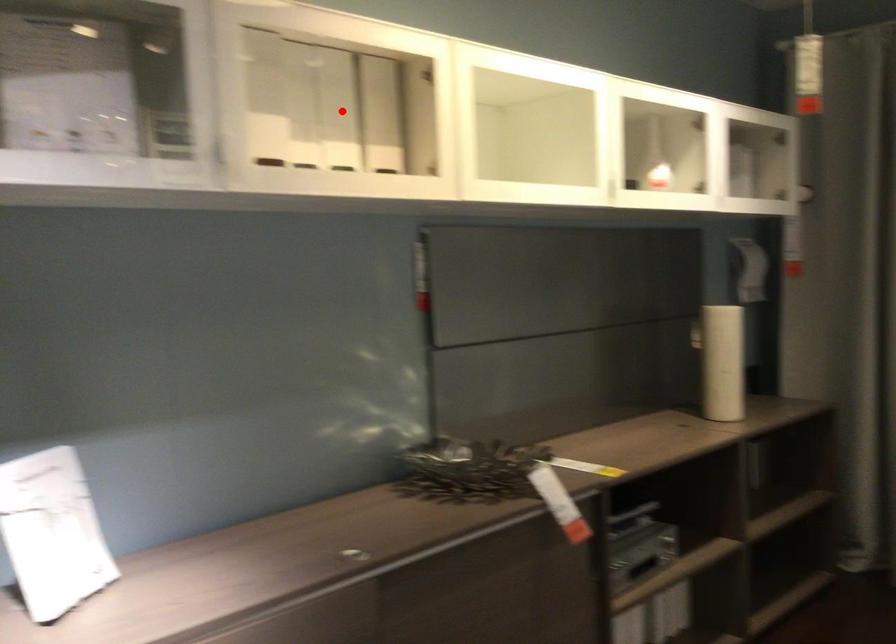
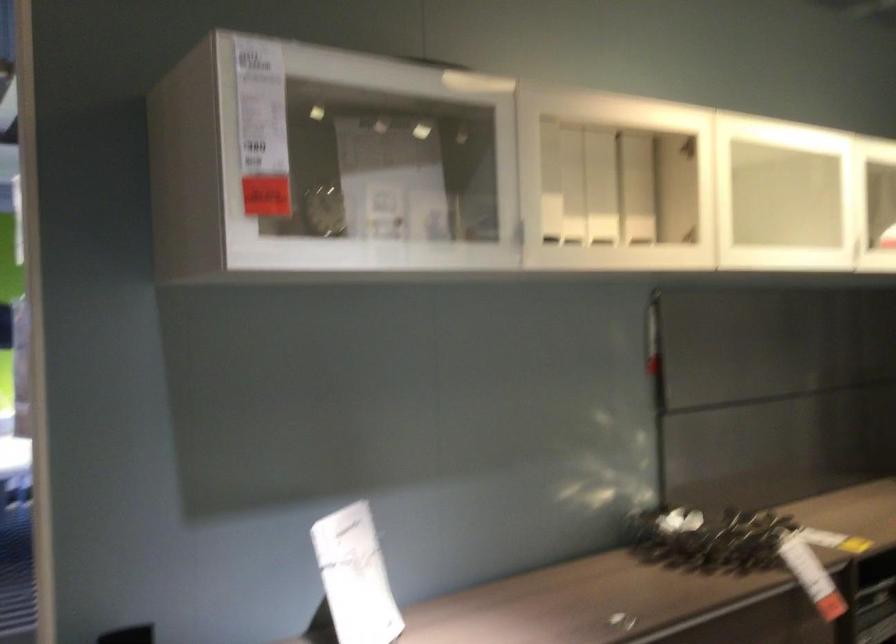
Question: I am providing you with two images of the same scene from different viewpoints. A red point is marked on the first image. Is the red point's position out of view in image 2?

Choices:
 (A) Yes
 (B) No

Answer: (B)